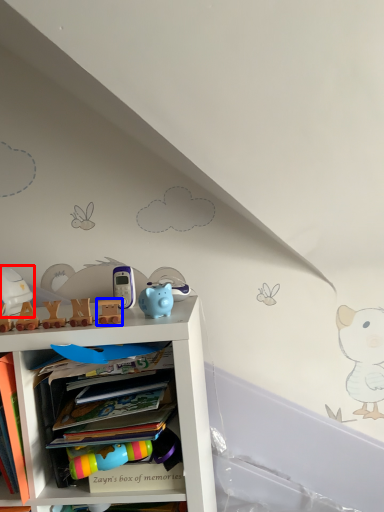
Question: Which object is further to the camera taking this photo, toy (highlighted by a red box) or toy (highlighted by a blue box)?

Choices:
 (A) toy
 (B) toy

Answer: (A)